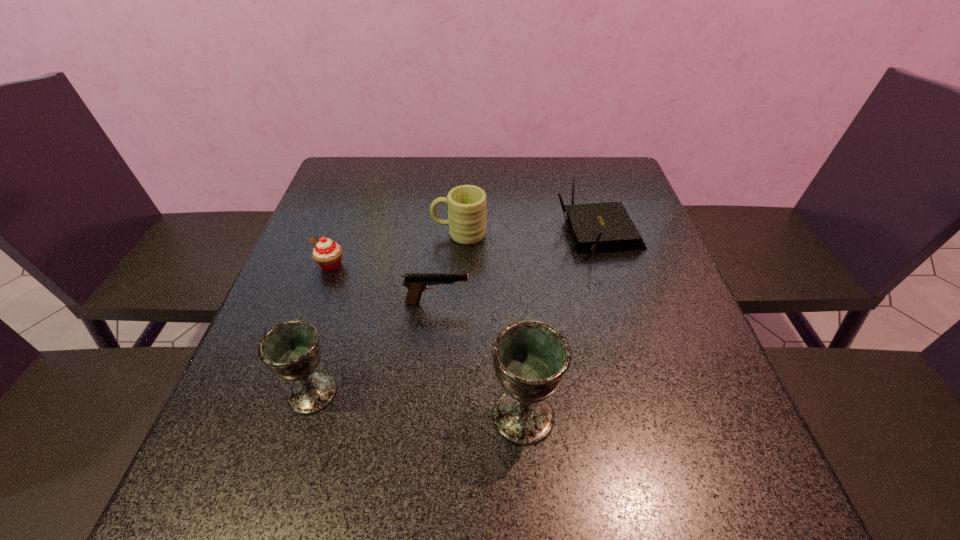
This screenshot has height=540, width=960. I want to click on blank area at the far edge, so click(x=538, y=158).

Where is `free region at the left edge of the desktop`? This screenshot has width=960, height=540. free region at the left edge of the desktop is located at coordinates (317, 296).

At what (x,y) coordinates should I click in order to perform the action: click on vacant space at the right edge of the desktop. Please return your answer as a coordinate pair (x, y). This screenshot has width=960, height=540. Looking at the image, I should click on (655, 248).

I want to click on free space at the far left corner of the desktop, so click(327, 189).

This screenshot has width=960, height=540. I want to click on free space between the taller chalice and the rightmost object, so click(x=561, y=324).

This screenshot has height=540, width=960. What are the coordinates of `vacant space that is in between the fourth shortest object and the right chalice` in the screenshot? It's located at (492, 325).

At what (x,y) coordinates should I click in order to perform the action: click on blank region between the right chalice and the fourth shortest object. Please return your answer as a coordinate pair (x, y). This screenshot has height=540, width=960. Looking at the image, I should click on (492, 325).

Identify the location of unoccupied area between the cupcake and the right chalice. (427, 340).

Identify the location of unoccupied area between the rightmost object and the mug. (529, 233).

What are the coordinates of `free space between the right chalice and the second tallest object` in the screenshot? It's located at (418, 404).